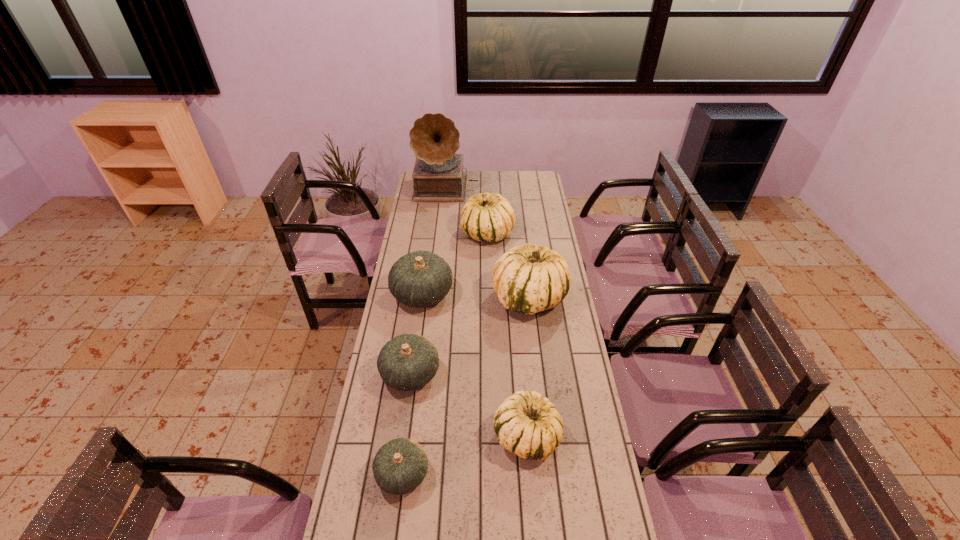
Image resolution: width=960 pixels, height=540 pixels. I want to click on vacant space that satisfies the following two spatial constraints: 1. from the horn of the farthest object; 2. on the right side of the second nearest white gourd, so click(434, 298).